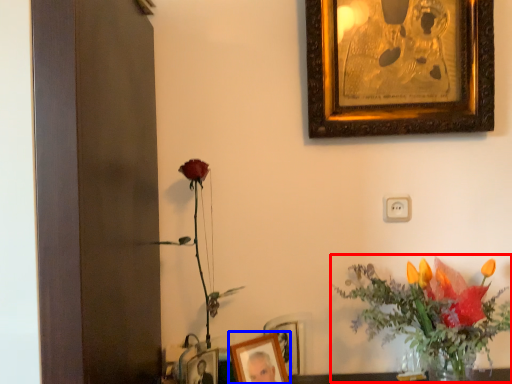
Question: Among these objects, which one is farthest to the camera, floral arrangement (highlighted by a red box) or picture frame (highlighted by a blue box)?

Choices:
 (A) floral arrangement
 (B) picture frame

Answer: (B)